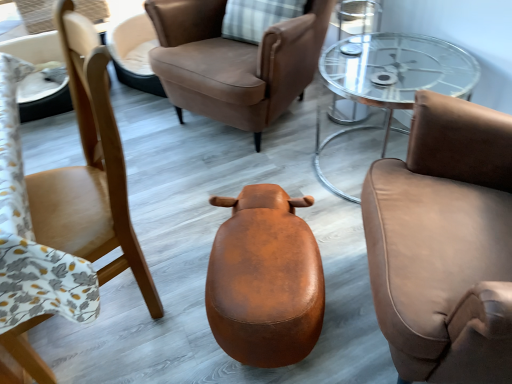
The image size is (512, 384). What do you see at coordinates (234, 62) in the screenshot?
I see `brown leather chair at center, which is the 2th chair from right to left` at bounding box center [234, 62].

This screenshot has height=384, width=512. Find the location of `brown leather chair at center, which is the 2th chair from right to left`. brown leather chair at center, which is the 2th chair from right to left is located at coordinates (234, 62).

Where is `clear glass coffee table at center`? clear glass coffee table at center is located at coordinates click(x=391, y=78).

Choose the correct answer: Is brown leather stool at center inside clear glass coffee table at center or outside it?

brown leather stool at center is outside clear glass coffee table at center.

Considering the sizes of objects brown leather stool at center and clear glass coffee table at center in the image provided, who is thinner, brown leather stool at center or clear glass coffee table at center?

With smaller width is clear glass coffee table at center.

Can you confirm if brown leather stool at center is bigger than clear glass coffee table at center?

No.

Considering the relative positions of brown leather stool at center and clear glass coffee table at center in the image provided, is brown leather stool at center to the right of clear glass coffee table at center from the viewer's perspective?

Result: No, brown leather stool at center is not to the right of clear glass coffee table at center.

Between point (182, 15) and point (53, 240), which one is positioned behind?

The point (182, 15) is farther.

Is brown leather chair at center, the second chair viewed from the left, at the left side of matte brown chair at left, which is the 1th chair from left to right?

In fact, brown leather chair at center, the second chair viewed from the left, is to the right of matte brown chair at left, which is the 1th chair from left to right.

Is brown leather chair at center, the second chair viewed from the left, facing towards matte brown chair at left, which is the 1th chair from left to right?

Yes, brown leather chair at center, the second chair viewed from the left, is facing matte brown chair at left, which is the 1th chair from left to right.

Can you tell me how much brown leather chair at right, the third chair when ordered from left to right, and matte brown chair at left, which is the 1th chair from left to right, differ in facing direction?

35.6 degrees separate the facing orientations of brown leather chair at right, the third chair when ordered from left to right, and matte brown chair at left, which is the 1th chair from left to right.

From a real-world perspective, is brown leather chair at right, the third chair when ordered from left to right, positioned under matte brown chair at left, which is the 1th chair from left to right, based on gravity?

No, from a real-world perspective, brown leather chair at right, the third chair when ordered from left to right, is not below matte brown chair at left, which is the 1th chair from left to right.

Considering the sizes of objects brown leather chair at right, which is the 1th chair from right to left, and matte brown chair at left, which is the 1th chair from left to right, in the image provided, who is smaller, brown leather chair at right, which is the 1th chair from right to left, or matte brown chair at left, which is the 1th chair from left to right,?

With smaller size is matte brown chair at left, which is the 1th chair from left to right.

Is brown leather chair at right, the third chair when ordered from left to right, not near matte brown chair at left, which is the 3th chair in right-to-left order?

No, there isn't a large distance between brown leather chair at right, the third chair when ordered from left to right, and matte brown chair at left, which is the 3th chair in right-to-left order.

How distant is brown leather stool at center from brown leather chair at center, which is the 2th chair from right to left?

brown leather stool at center is 36.82 inches away from brown leather chair at center, which is the 2th chair from right to left.

Is brown leather stool at center far from brown leather chair at center, the second chair viewed from the left?

No, brown leather stool at center is not far away from brown leather chair at center, the second chair viewed from the left.

Which object is further away from the camera taking this photo, brown leather stool at center or brown leather chair at center, the second chair viewed from the left?

Positioned behind is brown leather chair at center, the second chair viewed from the left.

Is brown leather stool at center wider than brown leather chair at center, which is the 2th chair from right to left?

No.

Relative to brown leather stool at center, is matte brown chair at left, which is the 1th chair from left to right, in front or behind?

matte brown chair at left, which is the 1th chair from left to right, is positioned closer to the viewer than brown leather stool at center.

Is matte brown chair at left, which is the 1th chair from left to right, shorter than brown leather stool at center?

No.

From the image's perspective, between matte brown chair at left, which is the 3th chair in right-to-left order, and brown leather stool at center, who is located below?

brown leather stool at center is shown below in the image.

Is matte brown chair at left, which is the 3th chair in right-to-left order, wider or thinner than brown leather stool at center?

Considering their sizes, matte brown chair at left, which is the 3th chair in right-to-left order, looks slimmer than brown leather stool at center.

Which of these two, brown leather chair at center, the second chair viewed from the left, or brown leather stool at center, is thinner?

Thinner between the two is brown leather stool at center.

Can you confirm if brown leather chair at center, which is the 2th chair from right to left, is taller than brown leather stool at center?

Indeed, brown leather chair at center, which is the 2th chair from right to left, has a greater height compared to brown leather stool at center.

The width and height of the screenshot is (512, 384). What are the coordinates of `the 1st chair above the brown leather stool at center (from a real-world perspective)` in the screenshot? It's located at (234, 62).

Would you say brown leather stool at center is part of brown leather chair at center, which is the 2th chair from right to left,'s contents?

No, brown leather stool at center is not inside brown leather chair at center, which is the 2th chair from right to left.

Which object is closer to the camera, brown leather chair at center, the second chair viewed from the left, or clear glass coffee table at center?

clear glass coffee table at center.

Is brown leather chair at center, the second chair viewed from the left, taller or shorter than clear glass coffee table at center?

In the image, brown leather chair at center, the second chair viewed from the left, appears to be taller than clear glass coffee table at center.

The width and height of the screenshot is (512, 384). What are the coordinates of `stool located on the left of clear glass coffee table at center` in the screenshot? It's located at (265, 279).

Where is `chair behind the matte brown chair at left, which is the 3th chair in right-to-left order`? The height and width of the screenshot is (384, 512). chair behind the matte brown chair at left, which is the 3th chair in right-to-left order is located at coordinates (234, 62).

From the image, which object appears to be nearer to clear glass coffee table at center, brown leather chair at right, which is the 1th chair from right to left, or brown leather stool at center?

brown leather chair at right, which is the 1th chair from right to left, lies closer to clear glass coffee table at center than the other object.

In the scene shown: Which object lies further to the anchor point brown leather chair at center, which is the 2th chair from right to left, matte brown chair at left, which is the 3th chair in right-to-left order, or brown leather stool at center?

Based on the image, brown leather stool at center appears to be further to brown leather chair at center, which is the 2th chair from right to left.

Based on their spatial positions, is matte brown chair at left, which is the 1th chair from left to right, or brown leather chair at center, which is the 2th chair from right to left, closer to brown leather chair at right, which is the 1th chair from right to left?

matte brown chair at left, which is the 1th chair from left to right.

Which object lies nearer to the anchor point brown leather stool at center, brown leather chair at right, which is the 1th chair from right to left, or clear glass coffee table at center?

Among the two, brown leather chair at right, which is the 1th chair from right to left, is located nearer to brown leather stool at center.

Estimate the real-world distances between objects in this image. Which object is further from clear glass coffee table at center, brown leather chair at right, the third chair when ordered from left to right, or matte brown chair at left, which is the 1th chair from left to right?

Among the two, matte brown chair at left, which is the 1th chair from left to right, is located further to clear glass coffee table at center.

From the picture: When comparing their distances from brown leather stool at center, does clear glass coffee table at center or matte brown chair at left, which is the 3th chair in right-to-left order, seem closer?

The object closer to brown leather stool at center is matte brown chair at left, which is the 3th chair in right-to-left order.

Looking at the image, which one is located closer to brown leather stool at center, brown leather chair at right, the third chair when ordered from left to right, or brown leather chair at center, the second chair viewed from the left?

brown leather chair at right, the third chair when ordered from left to right, is positioned closer to the anchor brown leather stool at center.

When comparing their distances from brown leather chair at center, which is the 2th chair from right to left, does brown leather stool at center or matte brown chair at left, which is the 3th chair in right-to-left order, seem further?

brown leather stool at center lies further to brown leather chair at center, which is the 2th chair from right to left, than the other object.

Identify the location of chair between matte brown chair at left, which is the 3th chair in right-to-left order, and clear glass coffee table at center from left to right. (234, 62).

This screenshot has height=384, width=512. What are the coordinates of `coffee table between matte brown chair at left, which is the 1th chair from left to right, and brown leather chair at right, which is the 1th chair from right to left, from left to right` in the screenshot? It's located at (391, 78).

Find the location of a particular element. stool between matte brown chair at left, which is the 3th chair in right-to-left order, and brown leather chair at right, which is the 1th chair from right to left, in the horizontal direction is located at coordinates (265, 279).

Locate an element on the screen. stool between matte brown chair at left, which is the 3th chair in right-to-left order, and clear glass coffee table at center from left to right is located at coordinates (265, 279).